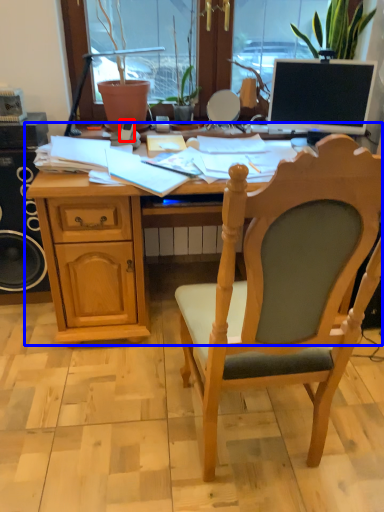
Question: Which object is closer to the camera taking this photo, mobile phone (highlighted by a red box) or desk (highlighted by a blue box)?

Choices:
 (A) mobile phone
 (B) desk

Answer: (B)